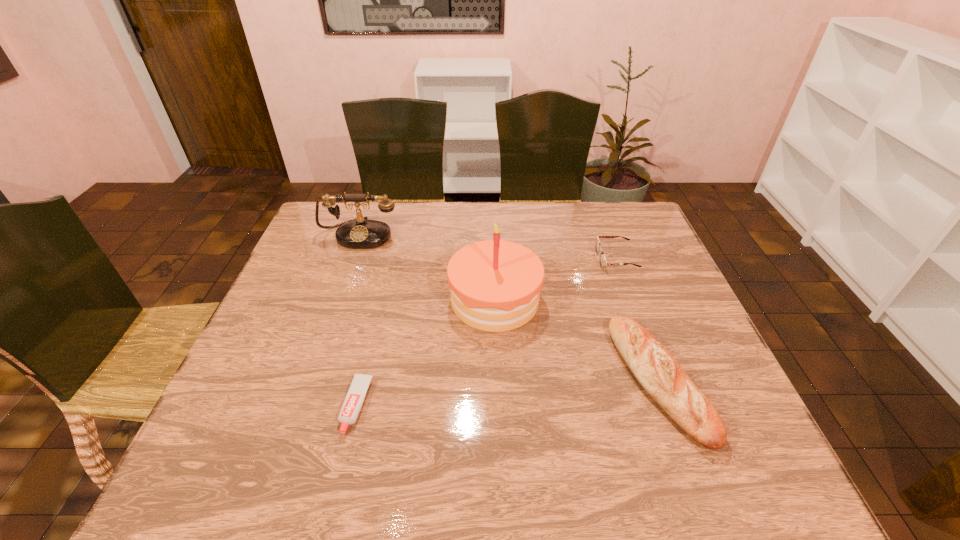
At what (x,y) coordinates should I click in order to perform the action: click on the third object from right to left. Please return your answer as a coordinate pair (x, y). This screenshot has width=960, height=540. Looking at the image, I should click on [x=495, y=285].

You are a GUI agent. You are given a task and a screenshot of the screen. Output one action in this format:
    pyautogui.click(x=<x>, y=<y>)
    Task: Click on the tallest object
    Image resolution: width=960 pixels, height=540 pixels.
    Given the screenshot: What is the action you would take?
    pyautogui.click(x=495, y=285)

The height and width of the screenshot is (540, 960). In order to click on the second tallest object in this screenshot , I will do `click(359, 233)`.

Where is `baguet`? Image resolution: width=960 pixels, height=540 pixels. baguet is located at coordinates coord(659,373).

The height and width of the screenshot is (540, 960). In order to click on spectacles in this screenshot , I will do `click(603, 262)`.

I want to click on toothpaste, so click(x=355, y=397).

Find the location of a particular element. The width and height of the screenshot is (960, 540). free space located on the front of the tallest object is located at coordinates (497, 360).

The width and height of the screenshot is (960, 540). Identify the location of free space located on the dial of the fourth shortest object. (319, 350).

I want to click on free space located on the back of the third tallest object, so coord(615,261).

This screenshot has height=540, width=960. What are the coordinates of `vacant space located on the frame of the spectacles` in the screenshot? It's located at (555, 259).